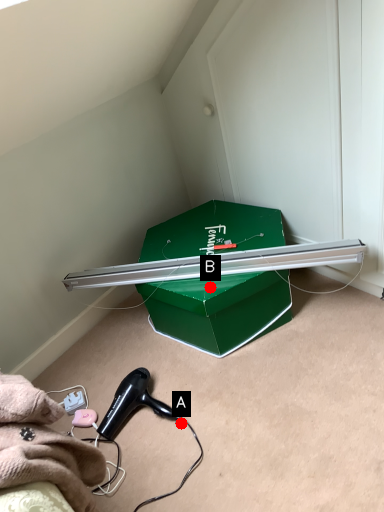
Question: Two points are circled on the image, labeled by A and B beside each circle. Which point is further to the camera?

Choices:
 (A) A is further
 (B) B is further

Answer: (B)